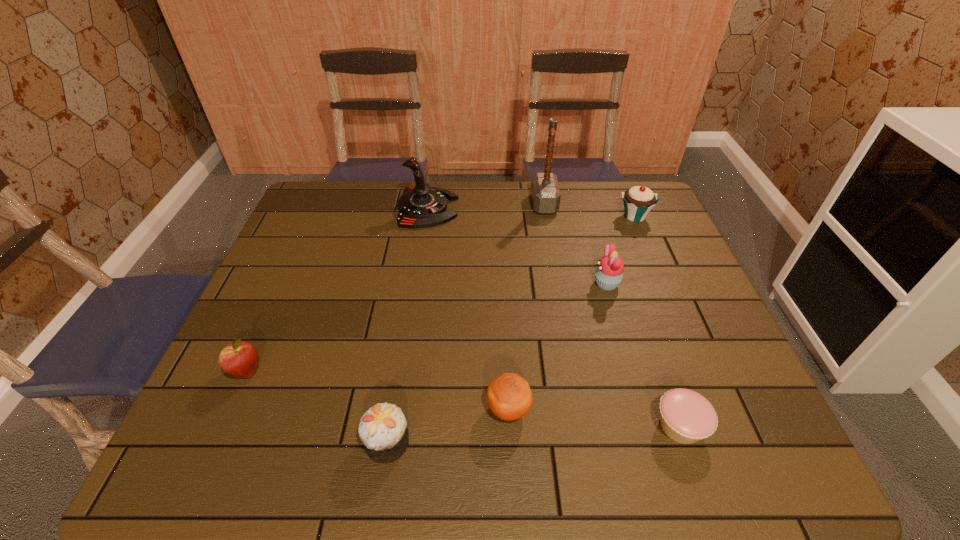
Find the location of a particular element. The width and height of the screenshot is (960, 540). vacant space located on the right of the second shortest cupcake is located at coordinates (589, 442).

I want to click on blank space located 0.340m on the left of the shortest cupcake, so click(x=489, y=426).

The height and width of the screenshot is (540, 960). What are the coordinates of `hammer that is at the far edge` in the screenshot? It's located at [545, 192].

Find the location of a particular element. joystick that is at the far edge is located at coordinates (420, 206).

You are a GUI agent. You are given a task and a screenshot of the screen. Output one action in this format:
    pyautogui.click(x=<x>, y=<y>)
    Task: Click on the cupcake that is at the far edge
    
    Given the screenshot: What is the action you would take?
    pyautogui.click(x=638, y=201)

You are a GUI agent. You are given a task and a screenshot of the screen. Output one action in this format:
    pyautogui.click(x=<x>, y=<y>)
    Task: Click on the object located in the left edge section of the desktop
    The height and width of the screenshot is (540, 960).
    Given the screenshot: What is the action you would take?
    pyautogui.click(x=240, y=359)

This screenshot has height=540, width=960. Find the location of `object present at the far right corner`. object present at the far right corner is located at coordinates (638, 201).

This screenshot has height=540, width=960. In order to click on object that is at the near right corner in this screenshot , I will do `click(686, 417)`.

Find the location of a particular element. The image size is (960, 540). free space at the far edge of the desktop is located at coordinates (607, 215).

Where is `free region at the near edge`? The width and height of the screenshot is (960, 540). free region at the near edge is located at coordinates (606, 435).